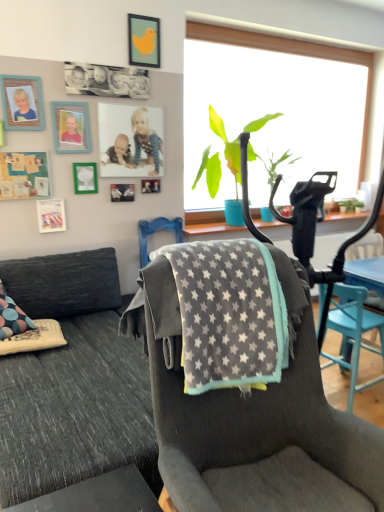
Question: From the image's perspective, is matte plastic photo frame at upper center, which is the fourth picture frame from top to bottom, on gray fabric chair at center, which ranks as the 2th chair in left-to-right order?

Choices:
 (A) yes
 (B) no

Answer: (A)

Question: Are matte plastic photo frame at upper center, which is the 6th picture frame from bottom to top, and gray fabric chair at center, placed as the 2th chair when sorted from front to back, far apart?

Choices:
 (A) yes
 (B) no

Answer: (A)

Question: Can you confirm if matte plastic photo frame at upper center, which is the fourth picture frame from top to bottom, is smaller than gray fabric chair at center, placed as the 2th chair when sorted from front to back?

Choices:
 (A) yes
 (B) no

Answer: (A)

Question: Is matte plastic photo frame at upper center, which is the fourth picture frame from top to bottom, behind gray fabric chair at center, arranged as the first chair when viewed from the right?

Choices:
 (A) yes
 (B) no

Answer: (A)

Question: Can you confirm if matte plastic photo frame at upper center, which is the fourth picture frame from top to bottom, is positioned to the right of gray fabric chair at center, which ranks as the 2th chair in left-to-right order?

Choices:
 (A) yes
 (B) no

Answer: (B)

Question: Is gray fleece blanket at center, the first chair when ordered from left to right, taller or shorter than metallic silver picture frame at upper left, which appears as the fifth picture frame when ordered from the bottom?

Choices:
 (A) tall
 (B) short

Answer: (A)

Question: In the image, is gray fleece blanket at center, placed as the first chair when sorted from front to back, on the left side or the right side of metallic silver picture frame at upper left, marked as the 5th picture frame in a top-to-bottom arrangement?

Choices:
 (A) left
 (B) right

Answer: (B)

Question: Is point (226, 426) closer or farther from the camera than point (72, 172)?

Choices:
 (A) farther
 (B) closer

Answer: (B)

Question: From a real-world perspective, is gray fleece blanket at center, placed as the first chair when sorted from front to back, physically located above or below metallic silver picture frame at upper left, marked as the 5th picture frame in a top-to-bottom arrangement?

Choices:
 (A) below
 (B) above

Answer: (A)

Question: Is metallic silver picture frame at upper left, positioned as the 1th picture frame in bottom-to-top order, inside or outside of wooden photo frame at upper left, the 8th picture frame when ordered from top to bottom?

Choices:
 (A) inside
 (B) outside

Answer: (B)

Question: From a real-world perspective, relative to wooden photo frame at upper left, the 8th picture frame when ordered from top to bottom, is metallic silver picture frame at upper left, acting as the ninth picture frame starting from the top, vertically above or below?

Choices:
 (A) below
 (B) above

Answer: (A)

Question: Considering the positions of point (44, 220) and point (112, 183), is point (44, 220) closer or farther from the camera than point (112, 183)?

Choices:
 (A) closer
 (B) farther

Answer: (A)

Question: In terms of size, does metallic silver picture frame at upper left, positioned as the 1th picture frame in bottom-to-top order, appear bigger or smaller than wooden photo frame at upper left, the 8th picture frame when ordered from top to bottom?

Choices:
 (A) big
 (B) small

Answer: (A)

Question: Is wooden photo frame at upper left, placed as the second picture frame when sorted from top to bottom, inside or outside of gray fleece blanket at center, which is the second chair in right-to-left order?

Choices:
 (A) outside
 (B) inside

Answer: (A)

Question: From a real-world perspective, is wooden photo frame at upper left, placed as the second picture frame when sorted from top to bottom, above or below gray fleece blanket at center, which is the second chair in right-to-left order?

Choices:
 (A) above
 (B) below

Answer: (A)